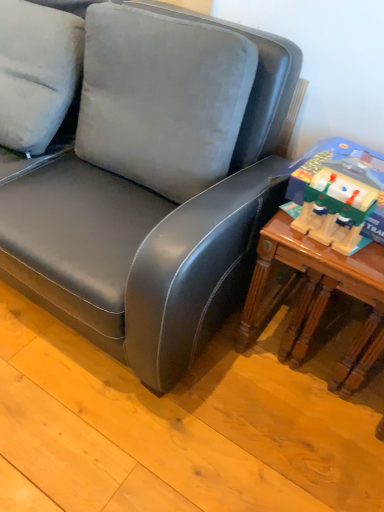
Find the location of a particular element. The width and height of the screenshot is (384, 512). free point below wooden table at right (from a real-world perspective) is located at coordinates (311, 341).